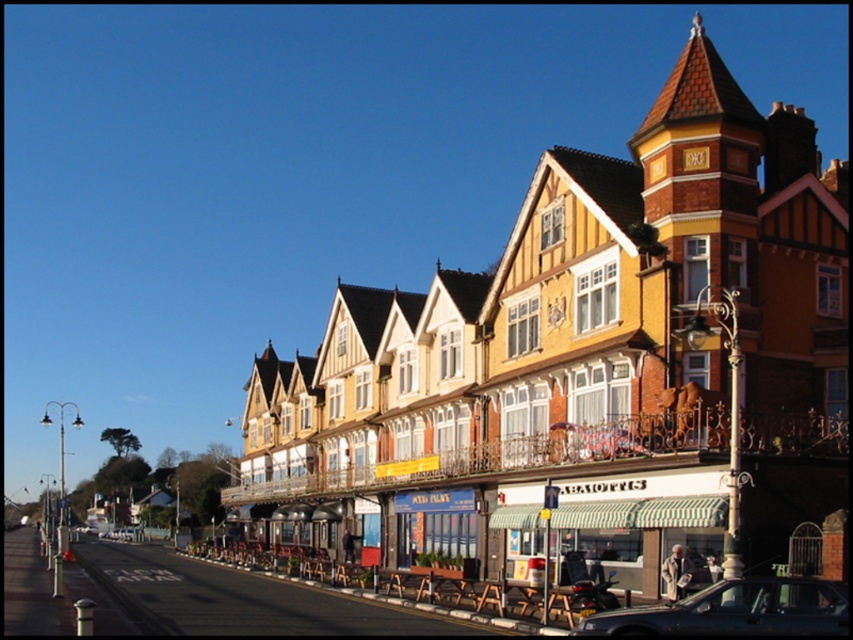
Question: Does yellow wooden building at center have a lesser width compared to wooden benches at center?

Choices:
 (A) yes
 (B) no

Answer: (B)

Question: Among these points, which one is nearest to the camera?

Choices:
 (A) (532, 488)
 (B) (447, 600)
 (C) (457, 440)
 (D) (770, 628)

Answer: (D)

Question: Among these objects, which one is farthest from the camera?

Choices:
 (A) wooden benches at center
 (B) white striped awning at center
 (C) yellow wooden building at center

Answer: (B)

Question: Can you confirm if yellow wooden building at center is positioned above metallic blue sedan at center?

Choices:
 (A) yes
 (B) no

Answer: (A)

Question: Is yellow wooden building at center to the right of metallic blue sedan at center from the viewer's perspective?

Choices:
 (A) no
 (B) yes

Answer: (B)

Question: Which point appears farthest from the camera in this image?

Choices:
 (A) (497, 513)
 (B) (405, 604)

Answer: (A)